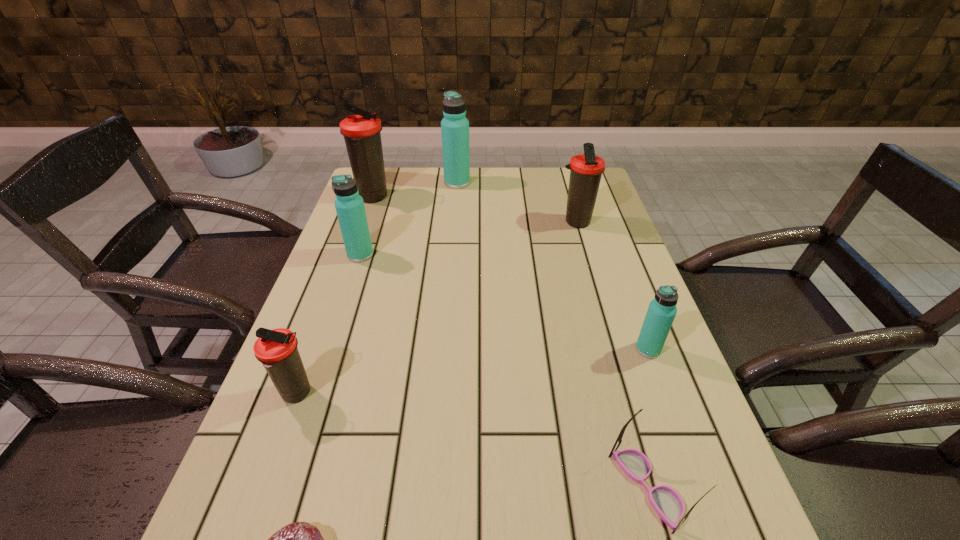
I want to click on spectacles present at the right edge, so click(668, 504).

Identify the location of object located at the far left corner. This screenshot has height=540, width=960. (362, 133).

I want to click on vacant space at the far edge of the desktop, so click(497, 191).

Where is `blank space at the left edge of the desktop`? blank space at the left edge of the desktop is located at coordinates (365, 285).

Locate an element on the screen. vacant space at the right edge of the desktop is located at coordinates (629, 407).

Find the location of a particular element. Image resolution: width=960 pixels, height=540 pixels. free space at the far right corner is located at coordinates (562, 167).

This screenshot has height=540, width=960. What are the coordinates of `vacant area that lies between the third nearest object and the spectacles` in the screenshot? It's located at (472, 440).

I want to click on vacant area that lies between the third nearest object and the spectacles, so click(x=472, y=440).

Identify the location of vacant point located between the smallest aqua thermos bottle and the biggest brown thermos bottle. The width and height of the screenshot is (960, 540). (511, 273).

Find the location of a particular element. The width and height of the screenshot is (960, 540). vacant area that lies between the farthest brown thermos bottle and the farthest aqua thermos bottle is located at coordinates (416, 190).